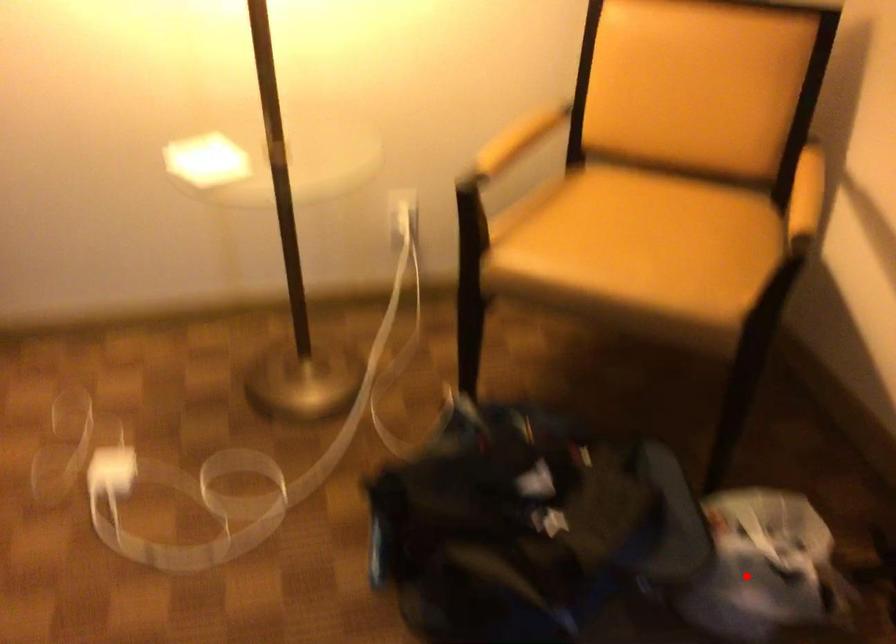
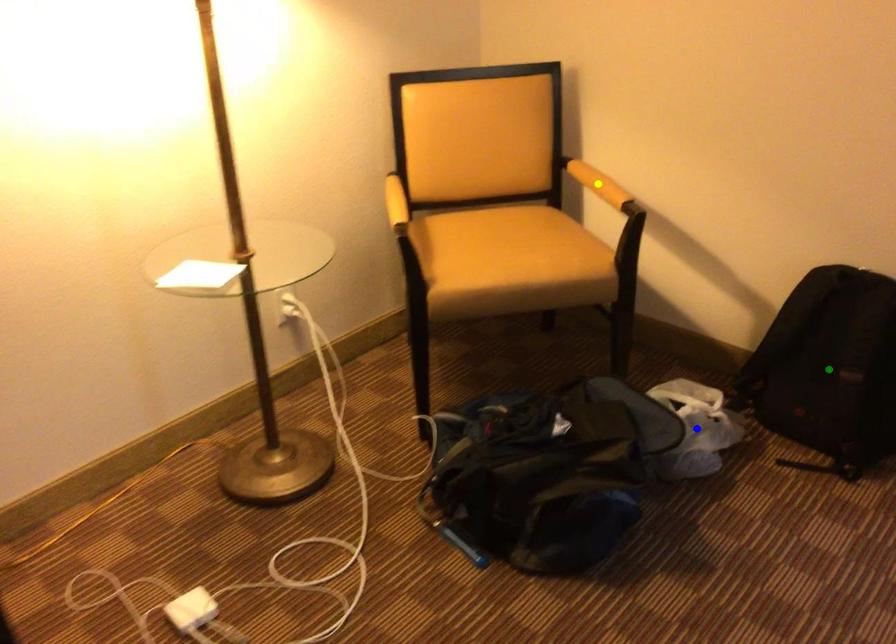
Question: I am providing you with two images of the same scene from different viewpoints. A red point is marked on the first image. You are given multiple points on the second image. Can you choose the point in image 2 that corresponds to the point in image 1?

Choices:
 (A) green point
 (B) blue point
 (C) yellow point

Answer: (B)